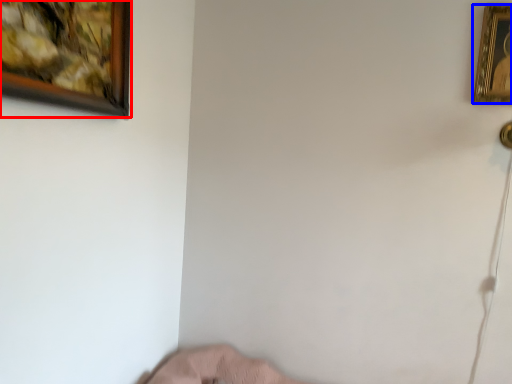
Question: Which of the following is the closest to the observer, picture frame (highlighted by a red box) or picture frame (highlighted by a blue box)?

Choices:
 (A) picture frame
 (B) picture frame

Answer: (A)